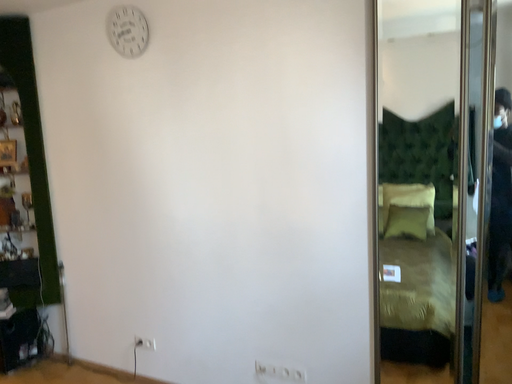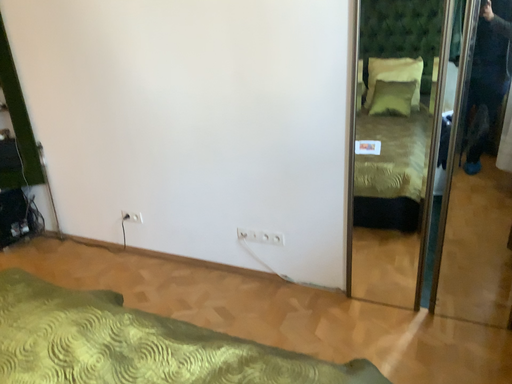
Question: How did the camera likely rotate when shooting the video?

Choices:
 (A) rotated downward
 (B) rotated upward

Answer: (A)